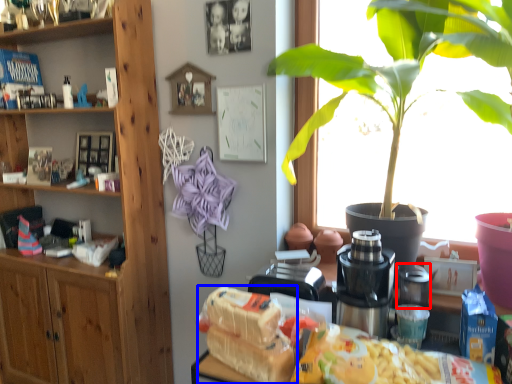
Question: Which object is further to the camera taking this photo, appliance (highlighted by a red box) or food (highlighted by a blue box)?

Choices:
 (A) appliance
 (B) food

Answer: (A)